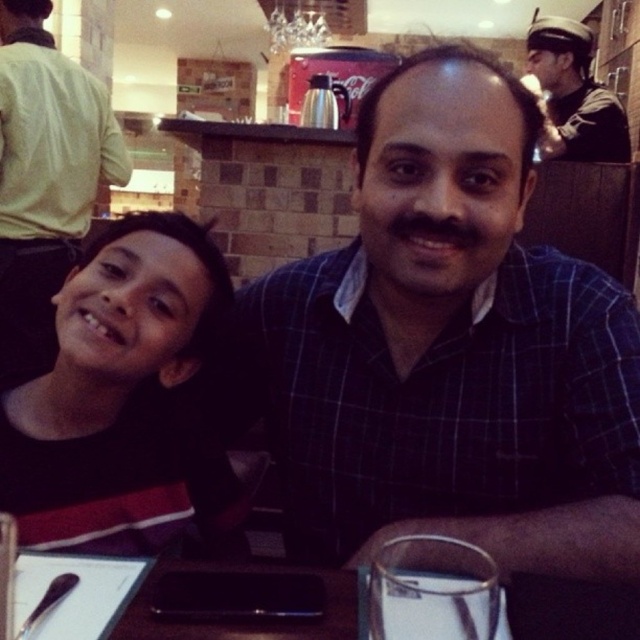
Question: Can you confirm if black fabric shirt at left is positioned below matte black shirt at left?

Choices:
 (A) no
 (B) yes

Answer: (B)

Question: Does black fabric shirt at left have a larger size compared to matte black shirt at left?

Choices:
 (A) yes
 (B) no

Answer: (B)

Question: Which object appears farthest from the camera in this image?

Choices:
 (A) black fabric shirt at left
 (B) matte black shirt at left
 (C) blue checkered shirt at center

Answer: (B)

Question: Does black fabric shirt at left appear under dark blue uniform at upper right?

Choices:
 (A) no
 (B) yes

Answer: (B)

Question: Which object is the closest to the dark blue uniform at upper right?

Choices:
 (A) matte black shirt at left
 (B) black fabric shirt at left
 (C) blue checkered shirt at center

Answer: (A)

Question: Which is farther from the matte black shirt at left?

Choices:
 (A) black fabric shirt at left
 (B) dark blue uniform at upper right

Answer: (B)